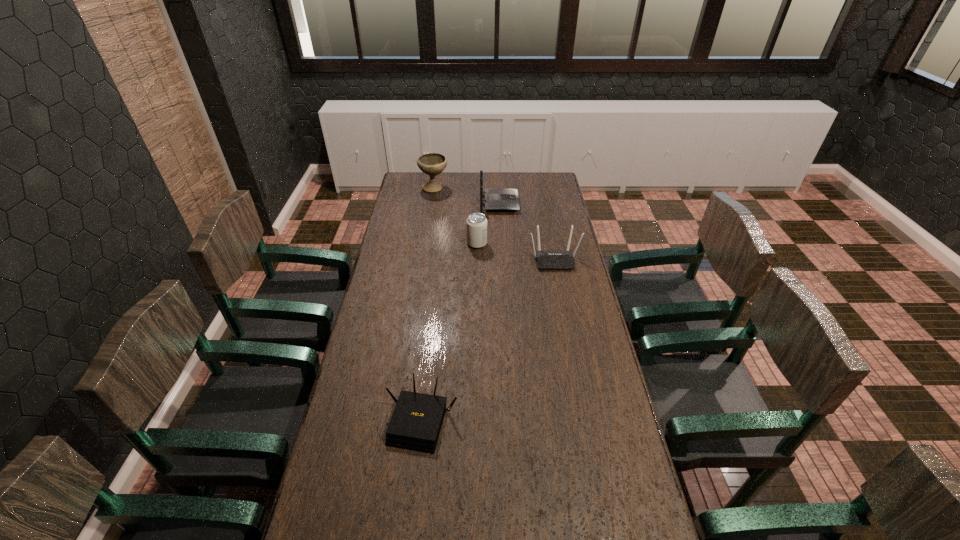
This screenshot has width=960, height=540. Identify the location of the tallest object. (432, 164).

At what (x,y) coordinates should I click in order to perform the action: click on the second router from left to right. Please return your answer as a coordinate pair (x, y). The width and height of the screenshot is (960, 540). Looking at the image, I should click on (496, 199).

Find the location of a particular element. soda can is located at coordinates coord(476,224).

What are the coordinates of `the rightmost object` in the screenshot? It's located at (546, 260).

Find the location of a particular element. This screenshot has height=540, width=960. the second nearest router is located at coordinates (546, 260).

The height and width of the screenshot is (540, 960). Find the location of `the nearest object`. the nearest object is located at coordinates (415, 425).

This screenshot has width=960, height=540. I want to click on the nearest router, so click(x=415, y=425).

Find the location of a particular element. free space located 0.390m on the front of the tallest object is located at coordinates (426, 239).

You are a GUI agent. You are given a task and a screenshot of the screen. Output one action in this format:
    pyautogui.click(x=<x>, y=<y>)
    Task: Click on the vacant space located 0.100m on the front-facing side of the farthest router
    
    Given the screenshot: What is the action you would take?
    pyautogui.click(x=538, y=203)

At what (x,y) coordinates should I click in order to perform the action: click on vacant space located on the left of the soda can. Please return your answer as a coordinate pair (x, y). This screenshot has width=960, height=540. Looking at the image, I should click on (410, 244).